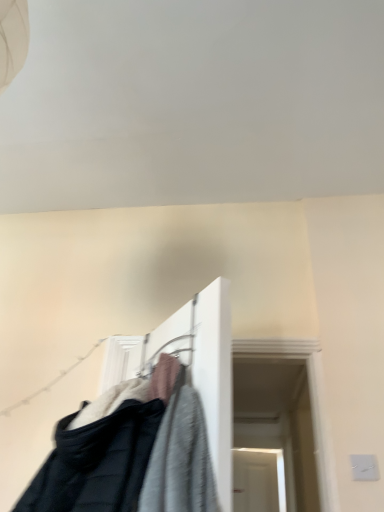
Where is `black fabric clothesline at lower left`? This screenshot has height=512, width=384. black fabric clothesline at lower left is located at coordinates (52, 380).

Describe the element at coordinates (52, 380) in the screenshot. I see `black fabric clothesline at lower left` at that location.

Measure the distance between point (59,449) and camera.

Point (59,449) is 3.74 feet away from camera.

Find the location of a particular element. textured fabric clothes at center is located at coordinates (151, 429).

This screenshot has width=384, height=512. What do you see at coordinates (151, 429) in the screenshot? I see `textured fabric clothes at center` at bounding box center [151, 429].

Where is `black fabric clothesline at lower left`? The width and height of the screenshot is (384, 512). black fabric clothesline at lower left is located at coordinates (52, 380).

Based on the photo, is black fabric clothesline at lower left at the right side of textured fabric clothes at center?

No, black fabric clothesline at lower left is not to the right of textured fabric clothes at center.

Between black fabric clothesline at lower left and textured fabric clothes at center, which one is positioned in front?

textured fabric clothes at center.

Is point (57, 380) closer to camera compared to point (228, 430)?

No, it is behind (228, 430).

Looking at this image, from the image's perspective, is black fabric clothesline at lower left positioned above or below textured fabric clothes at center?

Clearly, from the image's perspective, black fabric clothesline at lower left is below textured fabric clothes at center.

From a real-world perspective, is black fabric clothesline at lower left positioned above or below textured fabric clothes at center?

black fabric clothesline at lower left is above textured fabric clothes at center.

Can you confirm if black fabric clothesline at lower left is wider than textured fabric clothes at center?

No.

Based on the photo, from their relative heights in the image, would you say black fabric clothesline at lower left is taller or shorter than textured fabric clothes at center?

Clearly, black fabric clothesline at lower left is taller compared to textured fabric clothes at center.

Looking at this image, considering the sizes of black fabric clothesline at lower left and textured fabric clothes at center in the image, is black fabric clothesline at lower left bigger or smaller than textured fabric clothes at center?

black fabric clothesline at lower left is smaller than textured fabric clothes at center.

Could textured fabric clothes at center be considered to be inside black fabric clothesline at lower left?

No, black fabric clothesline at lower left does not contain textured fabric clothes at center.

Is black fabric clothesline at lower left not near textured fabric clothes at center?

No.

From the picture: Is black fabric clothesline at lower left oriented away from textured fabric clothes at center?

That's not correct — black fabric clothesline at lower left is not looking away from textured fabric clothes at center.

At what (x,y) coordinates should I click in order to perform the action: click on clothesline lying on the left of textured fabric clothes at center. Please return your answer as a coordinate pair (x, y). This screenshot has height=512, width=384. Looking at the image, I should click on (52, 380).

Which is more to the right, textured fabric clothes at center or black fabric clothesline at lower left?

Positioned to the right is textured fabric clothes at center.

Which object is further away from the camera taking this photo, textured fabric clothes at center or black fabric clothesline at lower left?

black fabric clothesline at lower left is further away from the camera.

Does point (141, 471) lie behind point (96, 344)?

No, it is not.

From the image's perspective, relative to black fabric clothesline at lower left, is textured fabric clothes at center above or below?

textured fabric clothes at center is above black fabric clothesline at lower left.

From a real-world perspective, between textured fabric clothes at center and black fabric clothesline at lower left, who is vertically lower?

In real-world perspective, textured fabric clothes at center is lower.

Does textured fabric clothes at center have a lesser width compared to black fabric clothesline at lower left?

In fact, textured fabric clothes at center might be wider than black fabric clothesline at lower left.

Is textured fabric clothes at center taller or shorter than black fabric clothesline at lower left?

Clearly, textured fabric clothes at center is shorter compared to black fabric clothesline at lower left.

Looking at the image, does textured fabric clothes at center seem bigger or smaller compared to black fabric clothesline at lower left?

Considering their sizes, textured fabric clothes at center takes up more space than black fabric clothesline at lower left.

Can we say textured fabric clothes at center lies outside black fabric clothesline at lower left?

Yes.

Is textured fabric clothes at center touching black fabric clothesline at lower left?

No, textured fabric clothes at center is not in contact with black fabric clothesline at lower left.

Is textured fabric clothes at center facing towards black fabric clothesline at lower left?

No, textured fabric clothes at center is not turned towards black fabric clothesline at lower left.

How many degrees apart are the facing directions of textured fabric clothes at center and black fabric clothesline at lower left?

The angle between the facing direction of textured fabric clothes at center and the facing direction of black fabric clothesline at lower left is 50.9 degrees.

From the picture: Measure the distance from textured fabric clothes at center to black fabric clothesline at lower left.

A distance of 27.31 inches exists between textured fabric clothes at center and black fabric clothesline at lower left.

The image size is (384, 512). I want to click on clothesline that is below the textured fabric clothes at center (from the image's perspective), so click(x=52, y=380).

Locate an element on the screen. This screenshot has width=384, height=512. clothesline below the textured fabric clothes at center (from the image's perspective) is located at coordinates (52, 380).

Where is `closet that appears below the black fabric clothesline at lower left (from a real-world perspective)`? The height and width of the screenshot is (512, 384). closet that appears below the black fabric clothesline at lower left (from a real-world perspective) is located at coordinates (151, 429).